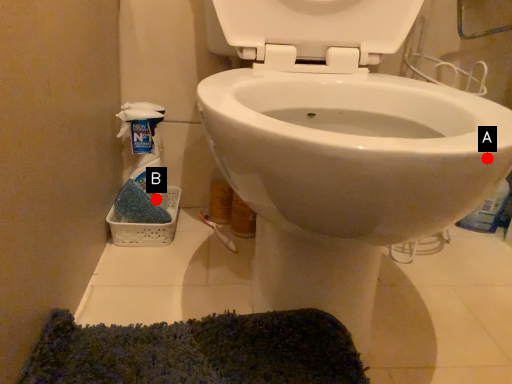
Question: Two points are circled on the image, labeled by A and B beside each circle. Which point is closer to the camera?

Choices:
 (A) A is closer
 (B) B is closer

Answer: (A)